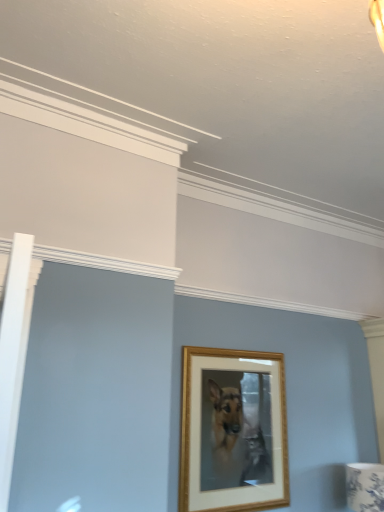
In order to face wooden picture frame at center, should I rotate leftwards or rightwards?

You should rotate right by 6.209 degrees.

You are a GUI agent. You are given a task and a screenshot of the screen. Output one action in this format:
    pyautogui.click(x=<x>, y=<y>)
    Task: Click on the wooden picture frame at center
    
    Given the screenshot: What is the action you would take?
    pyautogui.click(x=233, y=431)

Image resolution: width=384 pixels, height=512 pixels. What do you see at coordinates (233, 431) in the screenshot?
I see `wooden picture frame at center` at bounding box center [233, 431].

Locate an element on the screen. The width and height of the screenshot is (384, 512). wooden picture frame at center is located at coordinates (233, 431).